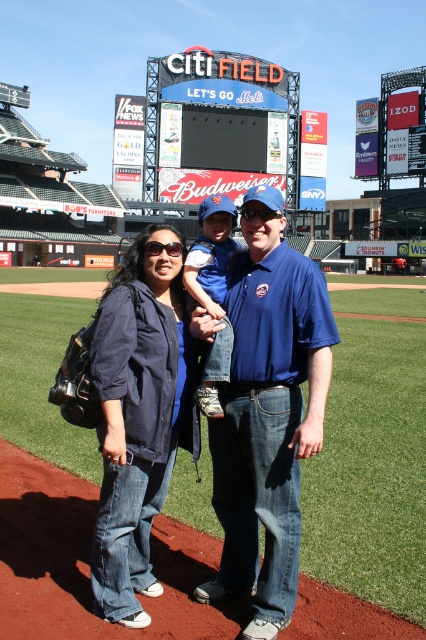
Who is shorter, denim jacket at lower left or neon sign at upper center?

denim jacket at lower left

Which is behind, point (175, 372) or point (238, 72)?

The point (238, 72) is behind.

I want to click on denim jacket at lower left, so click(138, 416).

Is blue cotton shirt at center bigger than neon sign at upper center?

Actually, blue cotton shirt at center might be smaller than neon sign at upper center.

Is blue cotton shirt at center to the right of neon sign at upper center from the viewer's perspective?

No, blue cotton shirt at center is not to the right of neon sign at upper center.

Who is more distant from viewer, (247, 304) or (239, 104)?

The point (239, 104) is behind.

At what (x,y) coordinates should I click in order to perform the action: click on blue cotton shirt at center. Please return your answer as a coordinate pair (x, y). Image resolution: width=426 pixels, height=640 pixels. Looking at the image, I should click on (267, 413).

Based on the photo, which is more to the left, blue cotton shirt at center or denim jacket at lower left?

Positioned to the left is denim jacket at lower left.

Does blue cotton shirt at center have a greater height compared to denim jacket at lower left?

Indeed, blue cotton shirt at center has a greater height compared to denim jacket at lower left.

Find the location of a particular element. This screenshot has width=426, height=640. blue cotton shirt at center is located at coordinates (267, 413).

You are a GUI agent. You are given a task and a screenshot of the screen. Output one action in this format:
    pyautogui.click(x=<x>, y=<y>)
    Task: Click on the blue cotton shirt at center
    The width and height of the screenshot is (426, 640).
    Given the screenshot: What is the action you would take?
    pyautogui.click(x=267, y=413)